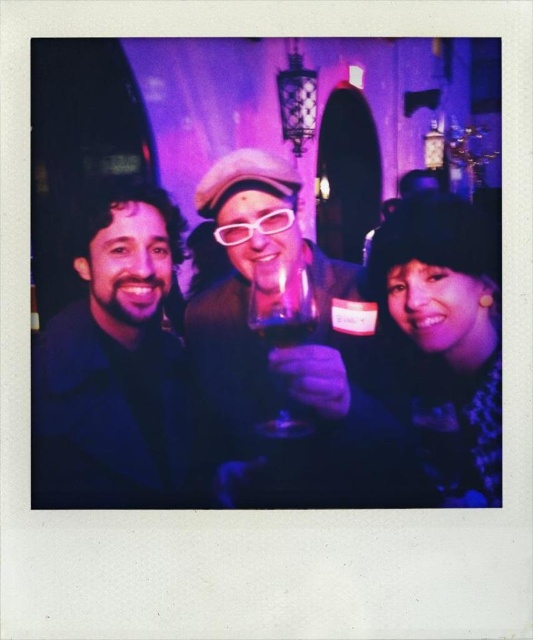
You are at a party and want to find the matte black jacket at left. Based on the scene description, where would you look relative to the central figure holding the wine glass?

The matte black jacket at left is located to the left of the central figure holding the wine glass, specifically at coordinates point (119, 365).

You are at a party and want to pour red wine into the matte plastic wine glass at center and the translucent glass wine at center. If both glasses are empty, which one can hold more wine?

The matte plastic wine glass at center is bigger than the translucent glass wine at center, so it can hold more wine.

You are at a party and see the matte plastic wine glass at center and the translucent glass wine at center. Which one is holding the other?

The matte plastic wine glass at center is positioned under the translucent glass wine at center, meaning the translucent glass wine at center is being held by the matte plastic wine glass at center.